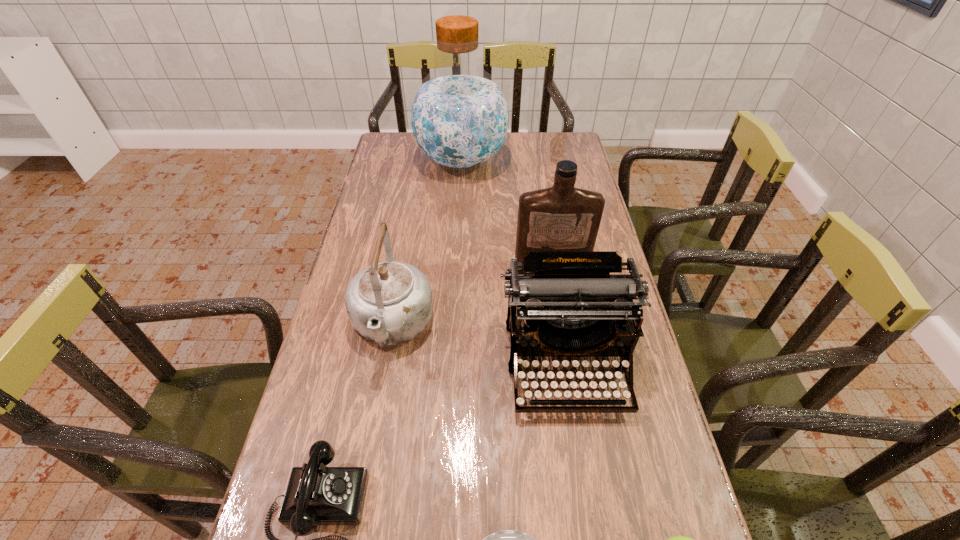
Where is `object that can be found as the closest to the tennis ball`? Image resolution: width=960 pixels, height=540 pixels. object that can be found as the closest to the tennis ball is located at coordinates (500, 539).

Locate an element on the screen. the third closest object to the sixth nearest object is located at coordinates (459, 116).